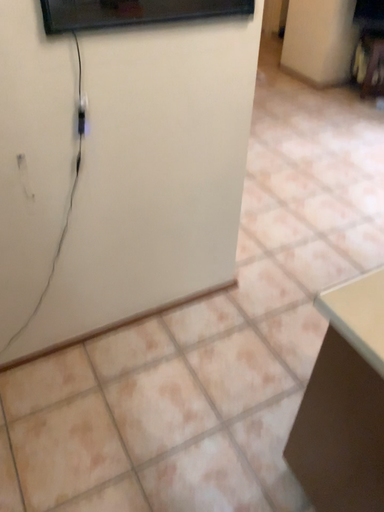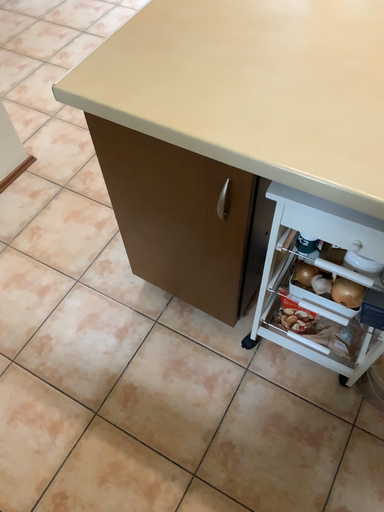
Question: How did the camera likely rotate when shooting the video?

Choices:
 (A) rotated right
 (B) rotated left

Answer: (A)